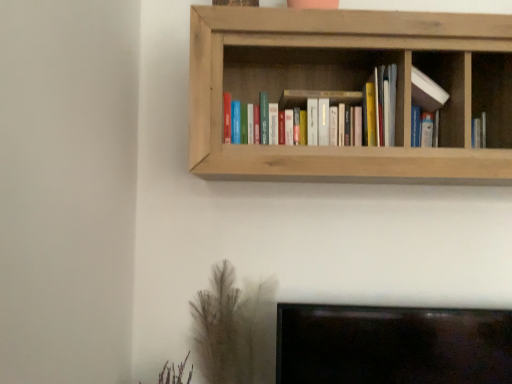
Question: From the image's perspective, would you say natural wood bookshelf at upper center is shown under brown textured plant at lower left?

Choices:
 (A) yes
 (B) no

Answer: (B)

Question: Can you confirm if natural wood bookshelf at upper center is bigger than brown textured plant at lower left?

Choices:
 (A) no
 (B) yes

Answer: (B)

Question: Is natural wood bookshelf at upper center oriented away from brown textured plant at lower left?

Choices:
 (A) no
 (B) yes

Answer: (A)

Question: Can you see natural wood bookshelf at upper center touching brown textured plant at lower left?

Choices:
 (A) no
 (B) yes

Answer: (A)

Question: From a real-world perspective, does natural wood bookshelf at upper center stand above brown textured plant at lower left?

Choices:
 (A) no
 (B) yes

Answer: (B)

Question: Does natural wood bookshelf at upper center have a greater height compared to brown textured plant at lower left?

Choices:
 (A) yes
 (B) no

Answer: (A)

Question: Can you confirm if brown textured plant at lower left is smaller than white matte bookshelf at upper center?

Choices:
 (A) yes
 (B) no

Answer: (B)

Question: Considering the relative sizes of brown textured plant at lower left and white matte bookshelf at upper center in the image provided, is brown textured plant at lower left shorter than white matte bookshelf at upper center?

Choices:
 (A) no
 (B) yes

Answer: (A)

Question: Is brown textured plant at lower left aimed at white matte bookshelf at upper center?

Choices:
 (A) no
 (B) yes

Answer: (A)

Question: Is the depth of brown textured plant at lower left less than that of white matte bookshelf at upper center?

Choices:
 (A) no
 (B) yes

Answer: (A)

Question: Does brown textured plant at lower left contain white matte bookshelf at upper center?

Choices:
 (A) no
 (B) yes

Answer: (A)

Question: Can you confirm if brown textured plant at lower left is bigger than white matte bookshelf at upper center?

Choices:
 (A) yes
 (B) no

Answer: (A)

Question: Is white matte bookshelf at upper center far away from natural wood bookshelf at upper center?

Choices:
 (A) no
 (B) yes

Answer: (A)